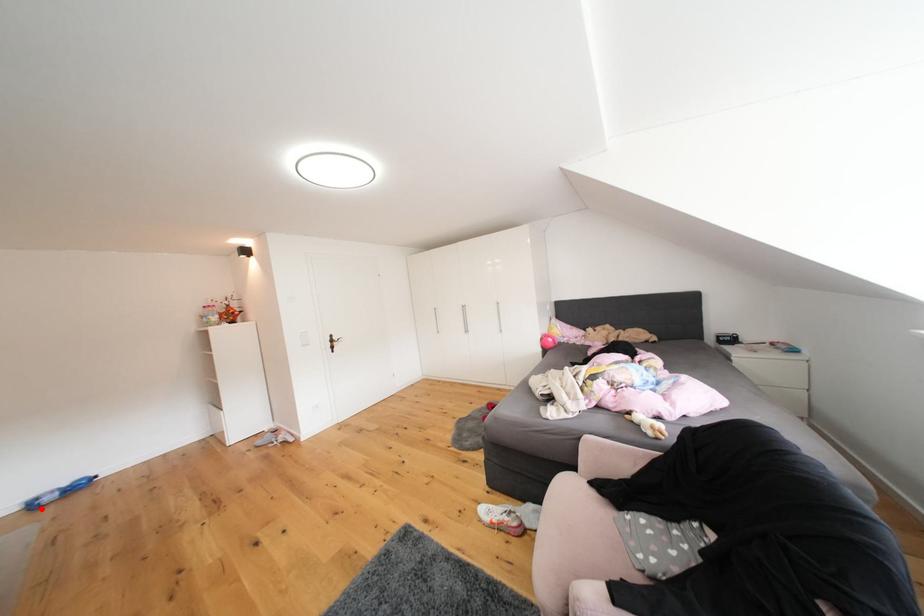
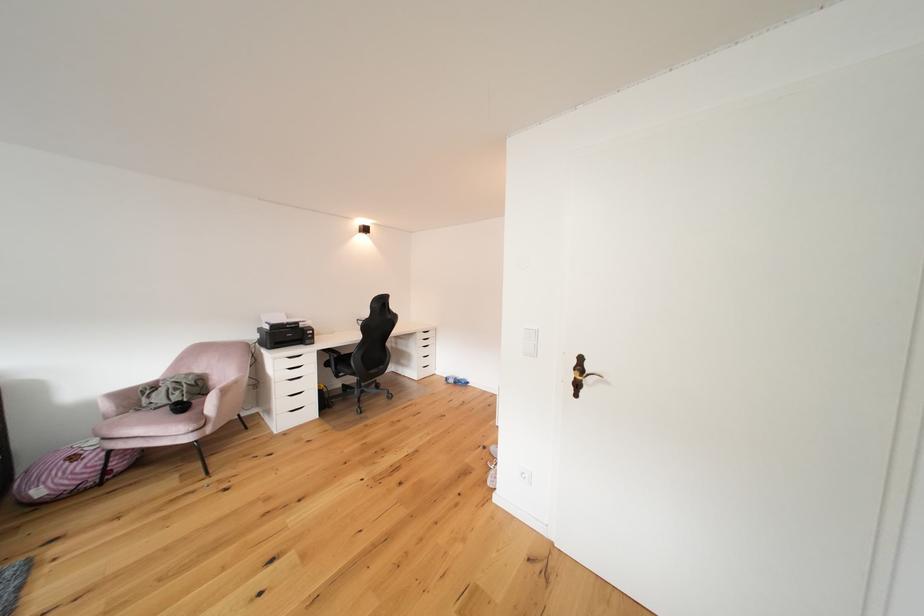
Find the pixel in the second image that matches the highlighted location in the first image.

(456, 383)